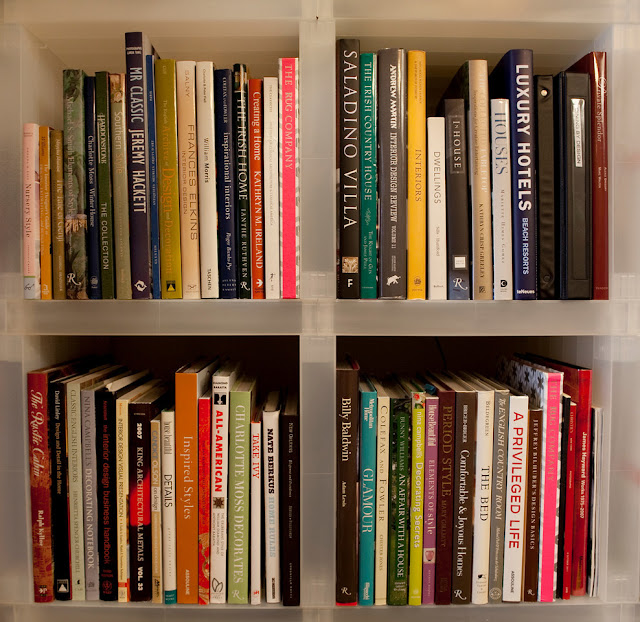
You are a GUI agent. You are given a task and a screenshot of the screen. Output one action in this format:
    pyautogui.click(x=<x>, y=<y>)
    Task: Click on the yellow books
    The width and height of the screenshot is (640, 622).
    Given the screenshot: What is the action you would take?
    pyautogui.click(x=420, y=258)